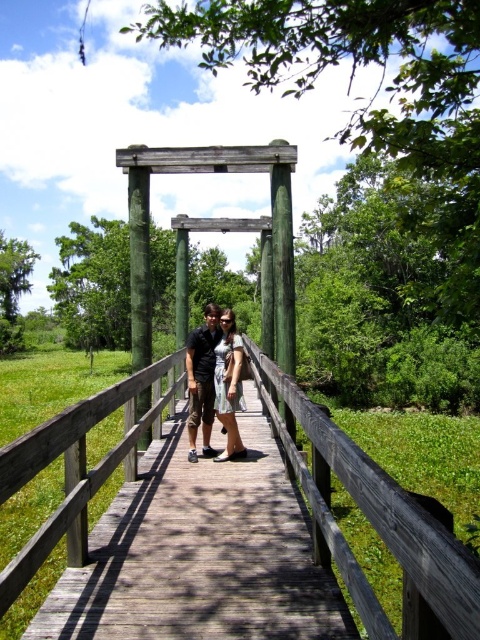
Question: Estimate the real-world distances between objects in this image. Which object is closer to the wooden bridge at center?

Choices:
 (A) dark gray shirt at center
 (B) matte green dress at center
 (C) green wood post at center

Answer: (B)

Question: Which point is farther from the camera taking this photo?

Choices:
 (A) (140, 180)
 (B) (241, 349)
 (C) (192, 381)

Answer: (A)

Question: Is green wood post at center closer to the viewer compared to matte green dress at center?

Choices:
 (A) yes
 (B) no

Answer: (A)

Question: Does wooden bridge at center have a smaller size compared to dark gray shirt at center?

Choices:
 (A) yes
 (B) no

Answer: (A)

Question: Can you confirm if green wood post at center is positioned to the right of matte green dress at center?

Choices:
 (A) no
 (B) yes

Answer: (A)

Question: Which object appears closest to the camera in this image?

Choices:
 (A) dark gray shirt at center
 (B) green wood post at center

Answer: (B)